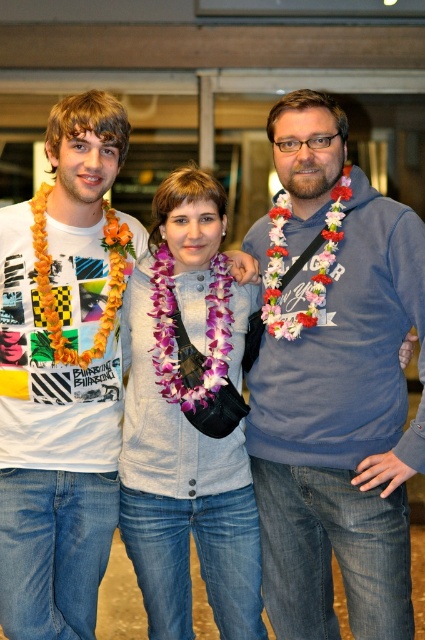
You are standing in a room with three people wearing leis. You want to take a photo of the blue fleece sweater at center without moving anyone. Can you reach it with a 2.5 meter long selfie stick?

The blue fleece sweater at center is 2.73 meters away from the viewer. Since the selfie stick is only 2.5 meters long, you cannot reach it.